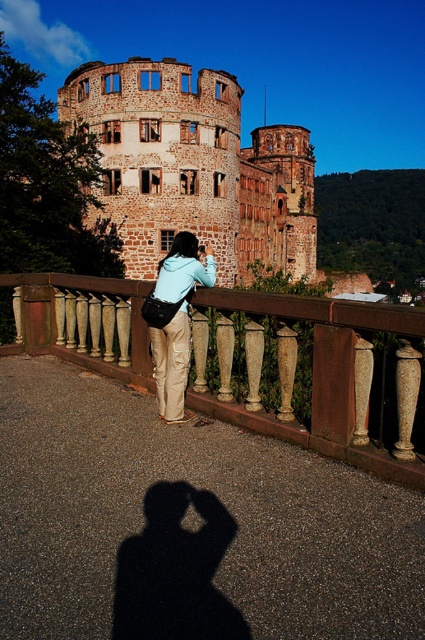
You are standing at the center of the image and want to take a photo of the historic stone building. Where should you position yourself relative to the brown wood railing at center to ensure the building is fully in frame?

To ensure the historic stone building is fully in frame, you should position yourself directly at the center of the image, as the brown wood railing at center is located at point (x=311, y=374), which is near the central area. This placement will allow the building to be centered and fully captured in the photograph.